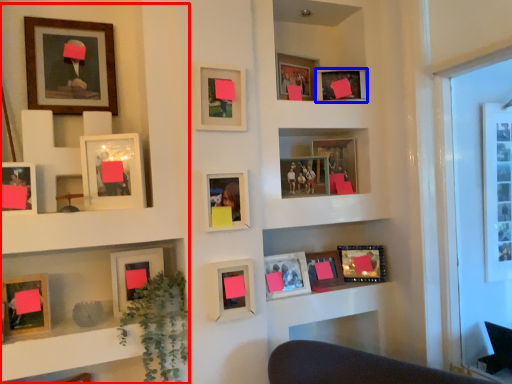
Question: Which object is further to the camera taking this photo, bookcase (highlighted by a red box) or picture frame (highlighted by a blue box)?

Choices:
 (A) bookcase
 (B) picture frame

Answer: (B)